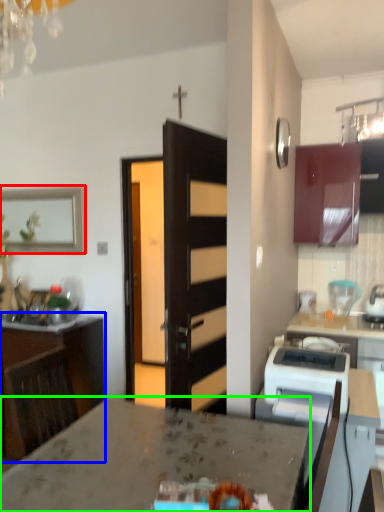
Question: Which object is positioned farthest from picture frame (highlighted by a red box)? Select from cabinetry (highlighted by a blue box) and countertop (highlighted by a green box).

Choices:
 (A) cabinetry
 (B) countertop

Answer: (B)